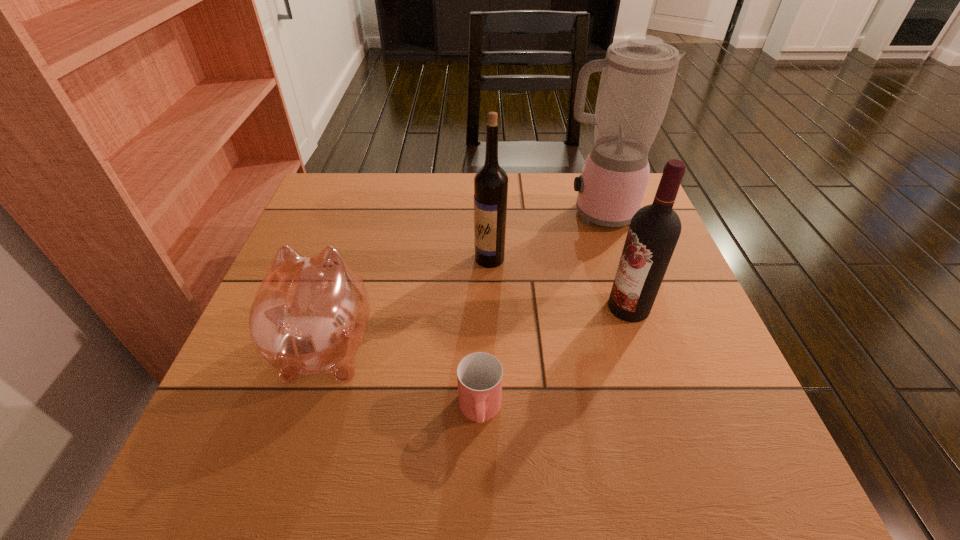
This screenshot has height=540, width=960. I want to click on food processor, so click(638, 74).

The height and width of the screenshot is (540, 960). Identify the location of the tallest object. (638, 74).

Where is `the left wine bottle`? This screenshot has width=960, height=540. the left wine bottle is located at coordinates (490, 182).

Locate an element on the screen. This screenshot has height=540, width=960. the farther wine bottle is located at coordinates (490, 182).

Identify the location of the nearer wine bottle. This screenshot has height=540, width=960. (654, 230).

Locate an element on the screen. piggy bank is located at coordinates (309, 316).

Where is `the second shortest object`? The width and height of the screenshot is (960, 540). the second shortest object is located at coordinates (309, 316).

At what (x,y) coordinates should I click in order to perform the action: click on the shortest object. Please return your answer as a coordinate pair (x, y). This screenshot has height=540, width=960. Looking at the image, I should click on (479, 375).

The height and width of the screenshot is (540, 960). In order to click on vacant space situated 0.310m on the base of the food processor near the control knob in this screenshot , I will do `click(444, 213)`.

Where is `free space located 0.320m on the base of the food processor near the control knob`? This screenshot has height=540, width=960. free space located 0.320m on the base of the food processor near the control knob is located at coordinates (440, 213).